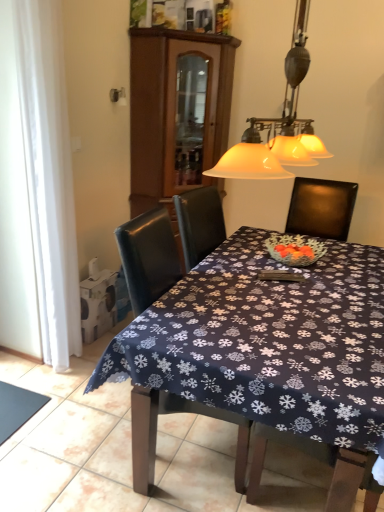
Locate an element on the screen. This screenshot has width=384, height=512. free spot to the right of dark blue fabric at lower left is located at coordinates (63, 416).